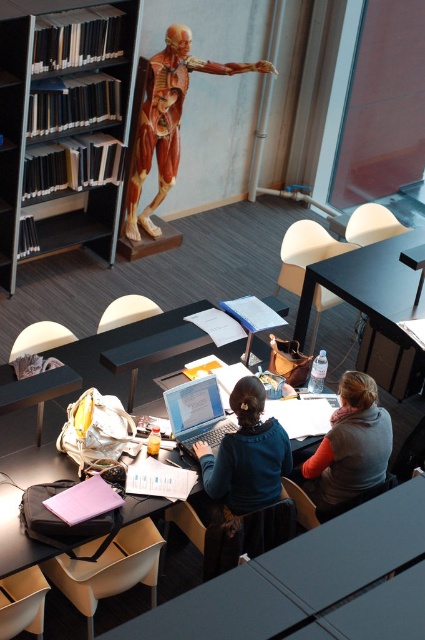
You are a student who needs to reach the black plastic bookcase at left from your current position. The classroom has a 5 meter wide door at the back. Can you walk directly to the bookcase without needing to go through the door?

The distance between you and the black plastic bookcase at left is 4.89 meters, which is less than the 5 meter width of the door. Therefore, you can walk directly to the black plastic bookcase at left without needing to go through the door.

You are organizing a classroom and need to place a new desk that is 1.2 meters wide. The desk must be placed between the black plastic bookcase at left and the silver metallic laptop at center. Can the desk fit in the space between them?

The black plastic bookcase at left might be wider than the silver metallic laptop at center, but without knowing the exact width of the space between them, it is uncertain if the 1.2 meter desk will fit. Additional measurements are needed to determine this.

You are organizing a small group activity in the classroom. You need to place a 2m long whiteboard between the matte black table at lower left and the black plastic table at center. Can you fit the whiteboard between them based on their sizes?

The matte black table at lower left occupies less space than the black plastic table at center, so there might be sufficient space between them to fit a 2m long whiteboard, but it depends on the exact distance between them. However, since the question only provides information about their sizes and not the distance between them, it is impossible to determine with certainty.